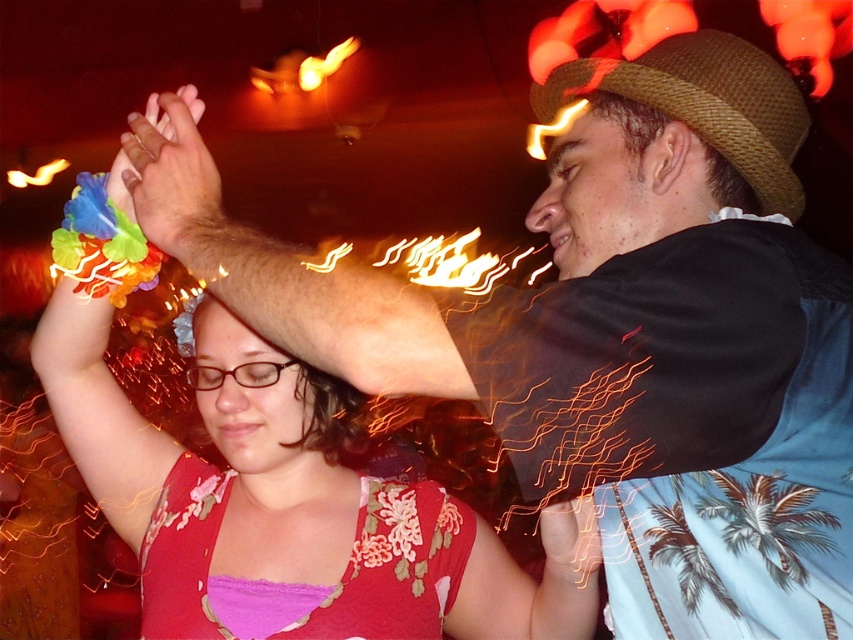
Question: Which object is the closest to the brown straw hat at upper right?

Choices:
 (A) floral fabric dress at center
 (B) matte floral bracelet at upper left

Answer: (B)

Question: Where is floral fabric dress at center located in relation to brown straw hat at upper right in the image?

Choices:
 (A) right
 (B) left

Answer: (B)

Question: Observing the image, what is the correct spatial positioning of embroidered silk dress at center in reference to brown straw hat at upper right?

Choices:
 (A) above
 (B) below

Answer: (B)

Question: Is embroidered silk dress at center thinner than matte floral bracelet at upper left?

Choices:
 (A) yes
 (B) no

Answer: (B)

Question: Which point is farther from the camera taking this photo?

Choices:
 (A) (776, 132)
 (B) (469, 577)
 (C) (129, 209)
 (D) (196, 636)

Answer: (B)

Question: Estimate the real-world distances between objects in this image. Which object is closer to the embroidered silk dress at center?

Choices:
 (A) brown straw hat at upper right
 (B) floral fabric dress at center

Answer: (B)